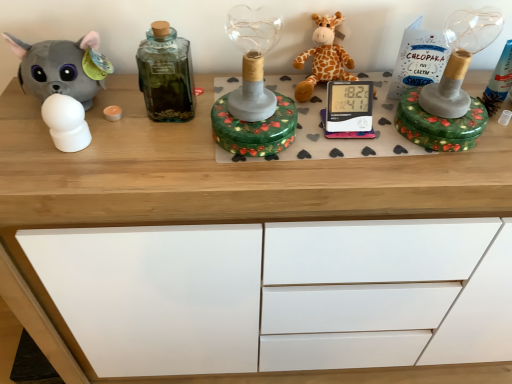
This screenshot has width=512, height=384. I want to click on free spot in front of green glass bottle at center, so click(x=156, y=156).